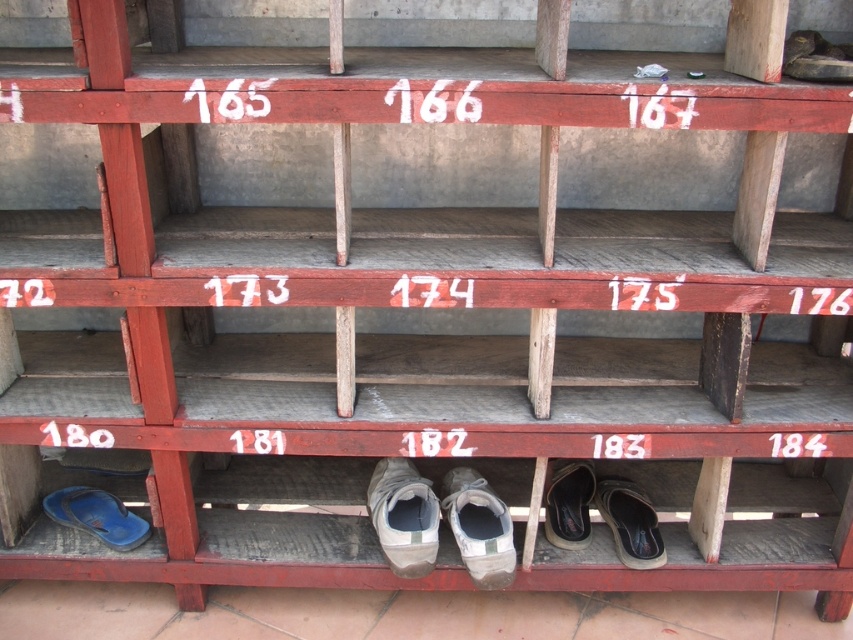
Looking at this image, you are standing in front of a red wooden shoe rack with numbered compartments. You need to place a new pair of shoes exactly where the white fabric shoe at lower center is currently located. However, you must ensure that the new shoes are placed at least 2 meters away from you to avoid blocking the entrance. Can you place the new shoes there?

The white fabric shoe at lower center is only 1.54 meters away from you, which is less than the required 2 meters. Therefore, placing the new shoes there would block the entrance.

You are standing in front of the wooden shoe rack. You notice two points marked on the rack at coordinates point (628, 554) and point (570, 516). If you want to touch both points with your finger, which point should you reach for first?

You should reach for point (628, 554) first because it is closer to you than point (570, 516).